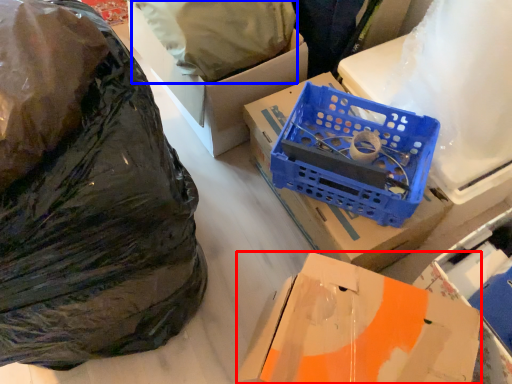
Question: Which object is closer to the camera taking this photo, box (highlighted by a red box) or wrapping paper (highlighted by a blue box)?

Choices:
 (A) box
 (B) wrapping paper

Answer: (A)